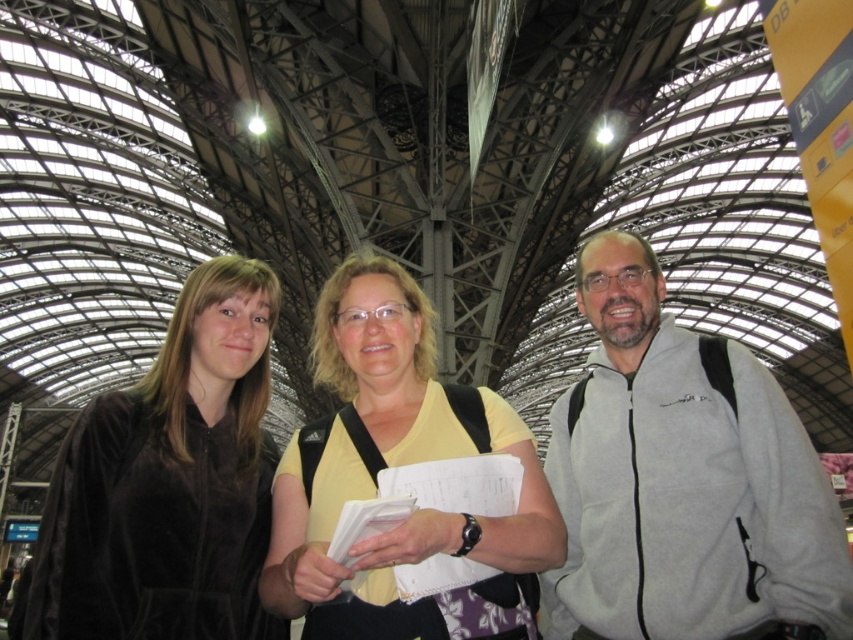
Question: Does gray fleece jacket at right have a larger size compared to yellow cotton shirt at center?

Choices:
 (A) yes
 (B) no

Answer: (B)

Question: Is velvet black jacket at left to the right of yellow cotton shirt at center from the viewer's perspective?

Choices:
 (A) no
 (B) yes

Answer: (A)

Question: Which of the following is the farthest from the observer?

Choices:
 (A) (440, 541)
 (B) (213, 614)

Answer: (B)

Question: Is gray fleece jacket at right thinner than velvet black jacket at left?

Choices:
 (A) yes
 (B) no

Answer: (B)

Question: Among these points, which one is nearest to the camera?

Choices:
 (A) [697, 564]
 (B) [480, 426]

Answer: (A)

Question: Which of the following is the farthest from the observer?

Choices:
 (A) velvet black jacket at left
 (B) gray fleece jacket at right
 (C) yellow cotton shirt at center

Answer: (C)